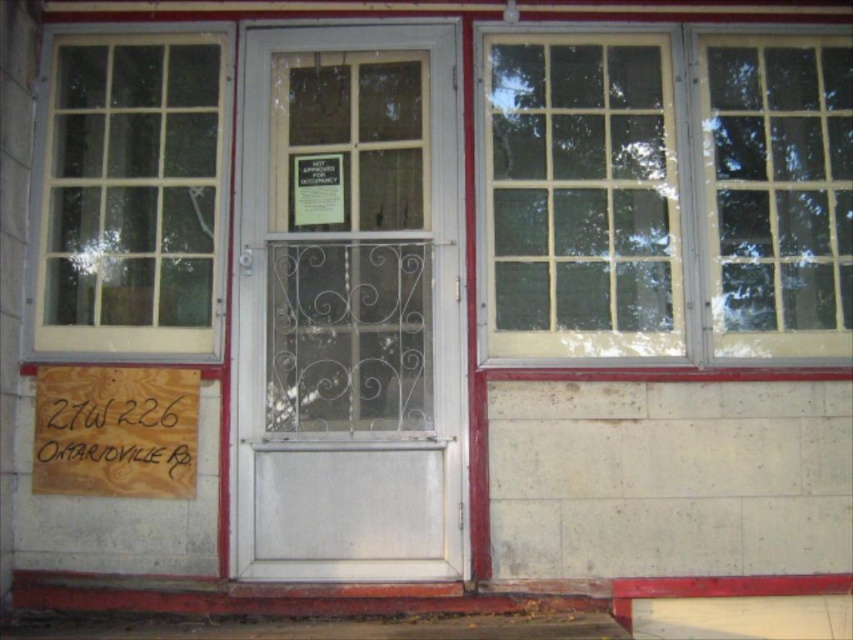
Is matte gray door at center positioned at the back of matte glass window at upper right?

No, it is not.

In the scene shown: Between matte gray door at center and matte glass window at upper right, which one appears on the right side from the viewer's perspective?

Positioned to the right is matte glass window at upper right.

What do you see at coordinates (349, 307) in the screenshot?
I see `matte gray door at center` at bounding box center [349, 307].

Locate an element on the screen. This screenshot has height=640, width=853. matte gray door at center is located at coordinates (349, 307).

Can you confirm if matte glass window at left is shorter than wooden sign at lower left?

No.

This screenshot has width=853, height=640. In order to click on matte glass window at left in this screenshot , I will do `click(132, 195)`.

Between point (137, 344) and point (163, 465), which one is positioned in front?

Point (163, 465)

At what (x,y) coordinates should I click in order to perform the action: click on matte glass window at left. Please return your answer as a coordinate pair (x, y). The image size is (853, 640). Looking at the image, I should click on (132, 195).

Does matte glass window at upper right appear over matte glass window at left?

Indeed, matte glass window at upper right is positioned over matte glass window at left.

In order to click on matte glass window at upper right in this screenshot , I will do `click(666, 195)`.

I want to click on matte glass window at upper right, so click(x=666, y=195).